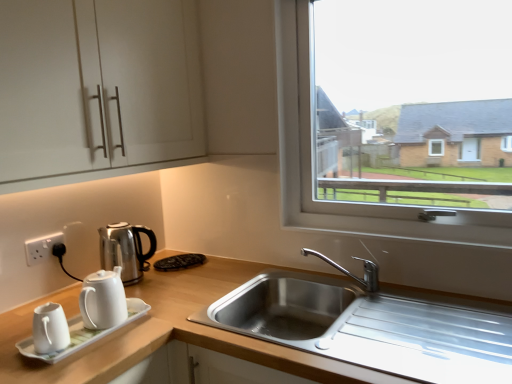
Question: From a real-world perspective, relative to white plastic electric outlet at lower left, is white glossy coffee pot at left vertically above or below?

Choices:
 (A) above
 (B) below

Answer: (B)

Question: Is point (124, 271) positioned closer to the camera than point (37, 253)?

Choices:
 (A) farther
 (B) closer

Answer: (A)

Question: Which of these objects is positioned closest to the white matte cabinet at upper left?

Choices:
 (A) white plastic electric outlet at lower left
 (B) white glossy coffee pot at left
 (C) chrome metallic faucet at sink right
 (D) white ceramic tea set at lower left
 (E) stainless steel sink at lower center

Answer: (B)

Question: Estimate the real-world distances between objects in this image. Which object is closer to the white glossy coffee pot at left?

Choices:
 (A) white ceramic tea set at lower left
 (B) stainless steel sink at lower center
 (C) chrome metallic faucet at sink right
 (D) white matte cabinet at upper left
 (E) white plastic electric outlet at lower left

Answer: (E)